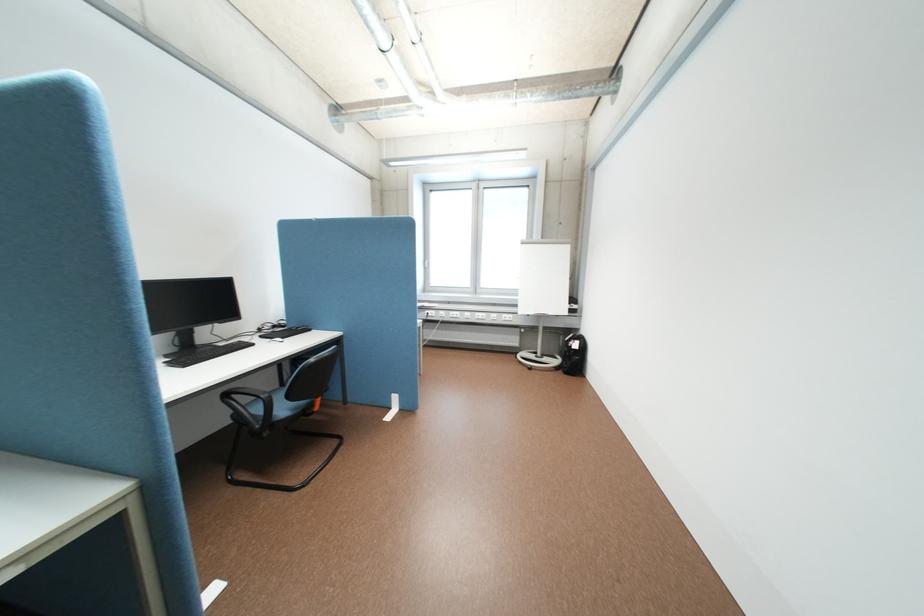
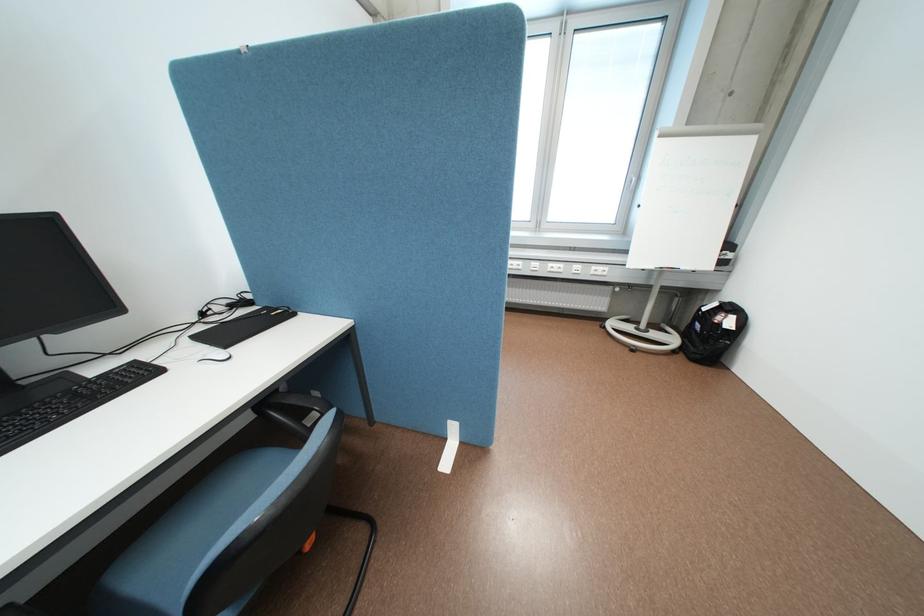
Where in the second image is the point corresponding to point 515,315 from the first image?

(604, 267)